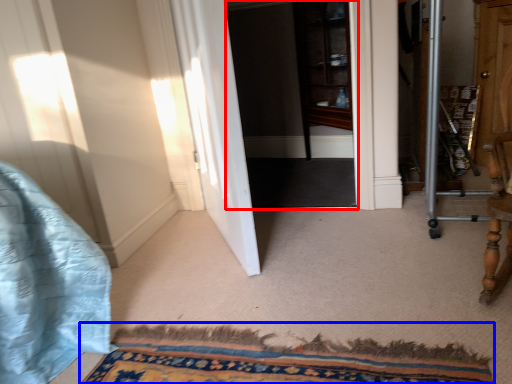
Question: Which object is further to the camera taking this photo, screen door (highlighted by a red box) or doormat (highlighted by a blue box)?

Choices:
 (A) screen door
 (B) doormat

Answer: (A)